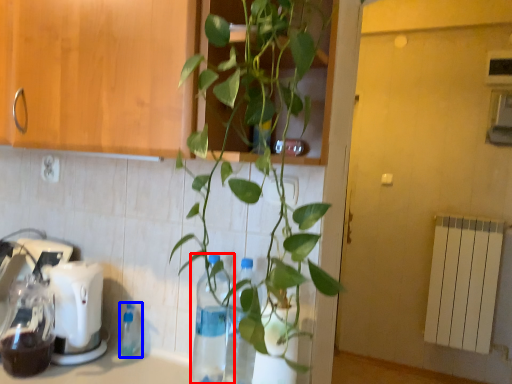
Question: Among these objects, which one is nearest to the camera, bottle (highlighted by a red box) or bottle (highlighted by a blue box)?

Choices:
 (A) bottle
 (B) bottle

Answer: (A)